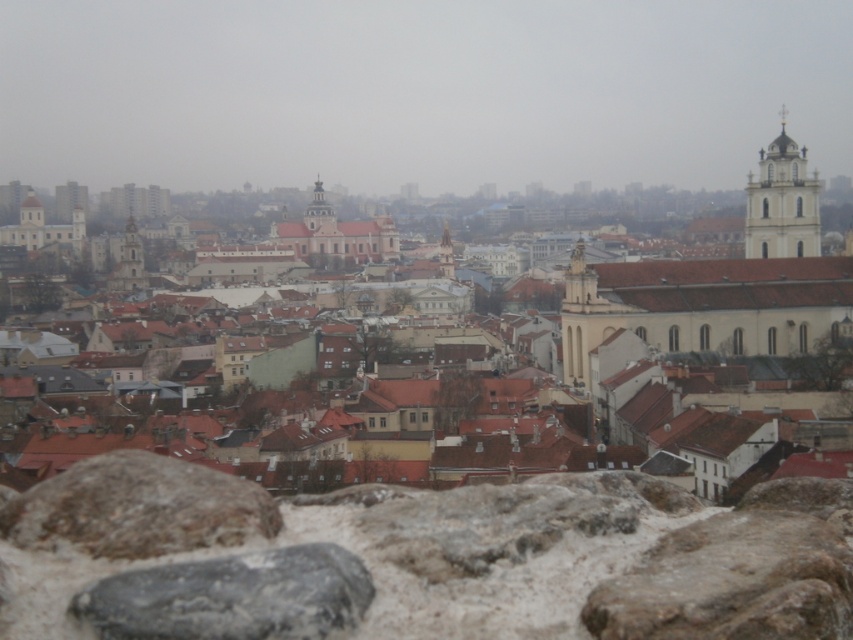
You are standing at the top of a hill overlooking the city. You notice two points marked on the image. The first point is at coordinate point(733, 529) and the second is at point(585, 292). Which point is closer to you?

Point(733, 529) is in front of point(585, 292), so it is closer to you.

You are standing at the top of a hill overlooking the city. You notice a point marked at coordinates (637, 429). What feature of the city is located at this point?

The brown tiled roofs at center are located at point (637, 429).

You are a tourist standing at the top of the hill looking at the gray rough stone at center and the smooth stone tower at center. Which object is taller?

The smooth stone tower at center is taller than the gray rough stone at center.